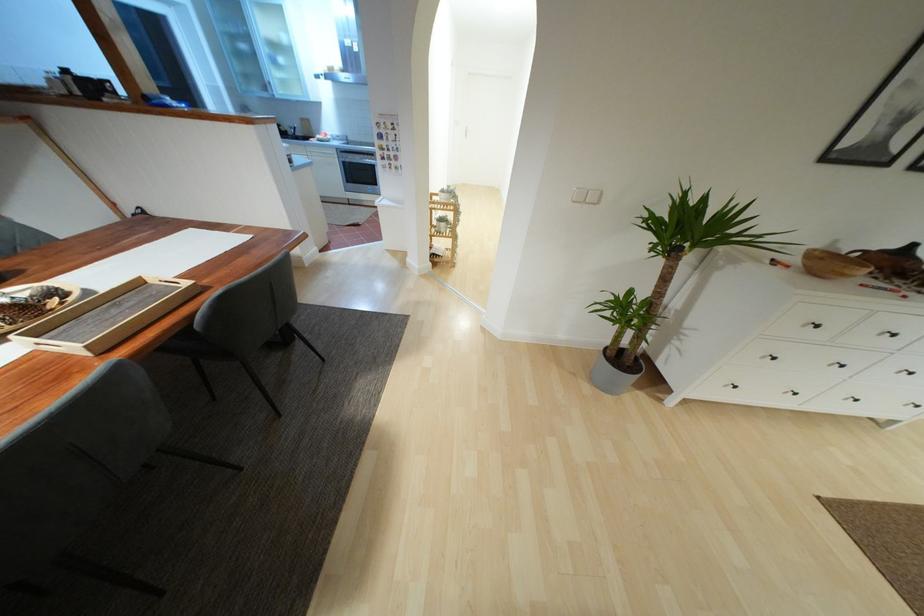
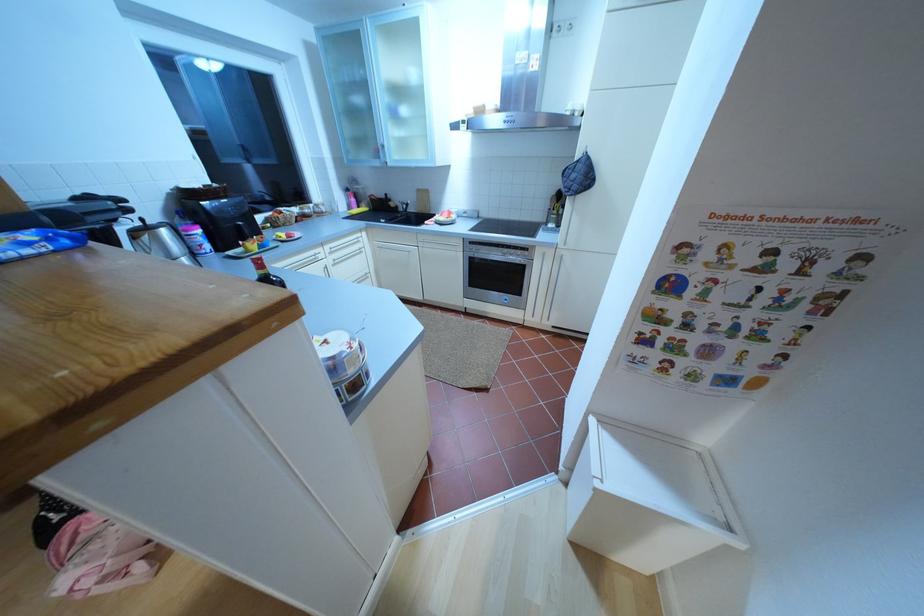
The images are taken continuously from a first-person perspective. In which direction are you moving?

The cameraman walked toward left, forward.